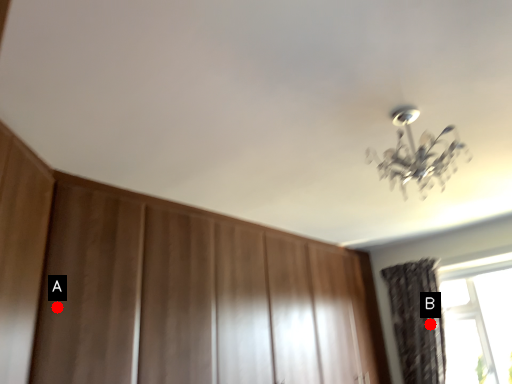
Question: Two points are circled on the image, labeled by A and B beside each circle. Which point is farther to the camera?

Choices:
 (A) A is further
 (B) B is further

Answer: (B)